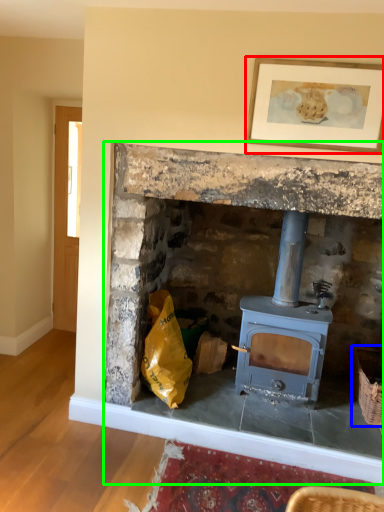
Question: Estimate the real-world distances between objects in this image. Which object is closer to picture frame (highlighted by a red box), basket (highlighted by a blue box) or fireplace (highlighted by a green box)?

Choices:
 (A) basket
 (B) fireplace

Answer: (B)